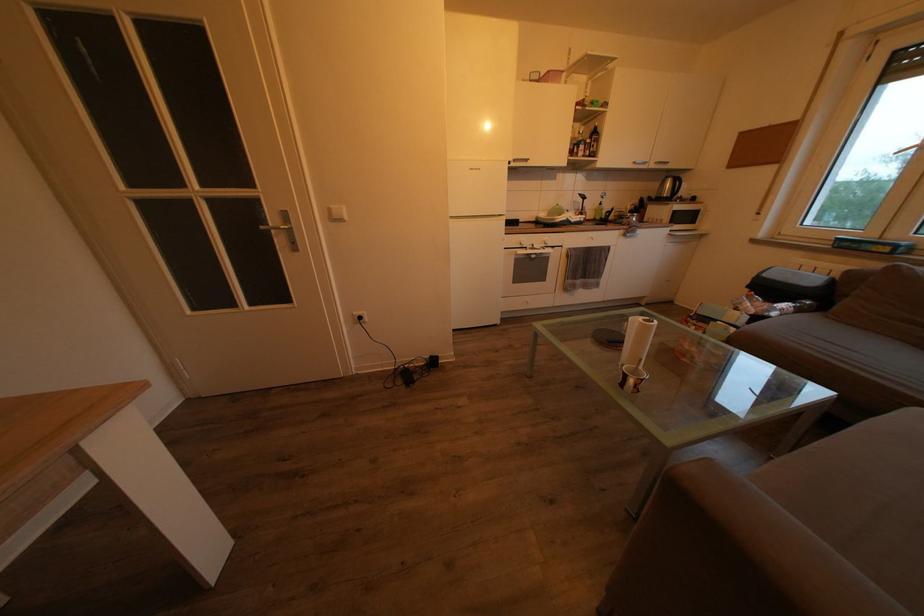
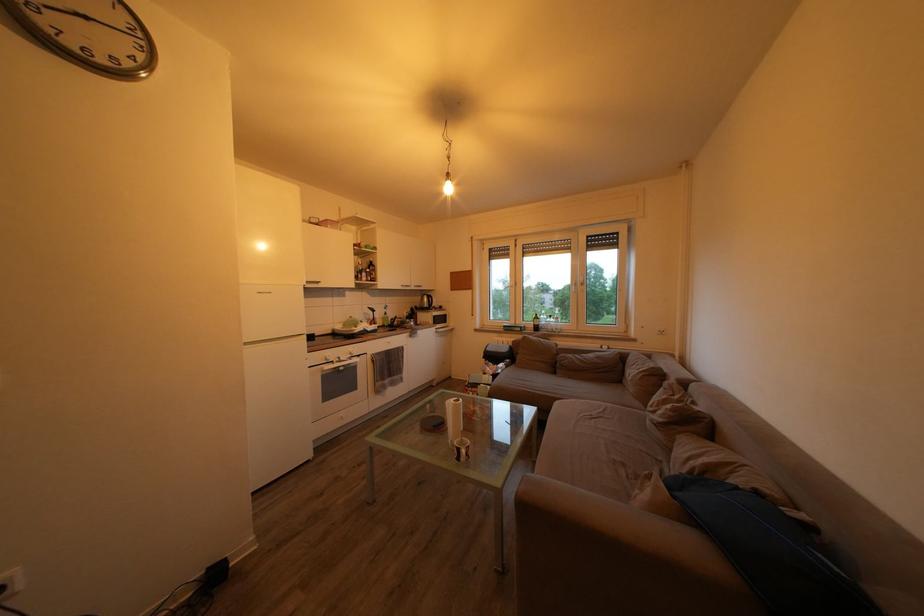
In the second image, find the point that corresponds to point (633, 383) in the first image.

(467, 456)